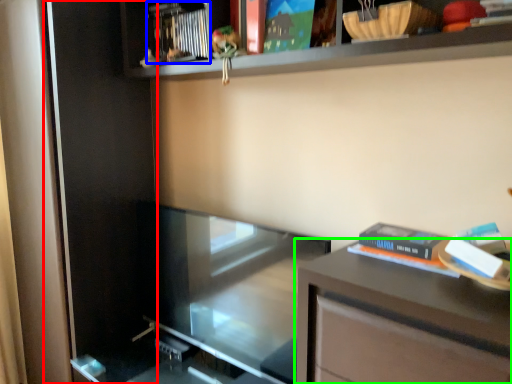
Question: Based on their relative distances, which object is farther from screen door (highlighted by a red box)? Choose from book (highlighted by a blue box) and table (highlighted by a green box).

Choices:
 (A) book
 (B) table

Answer: (B)